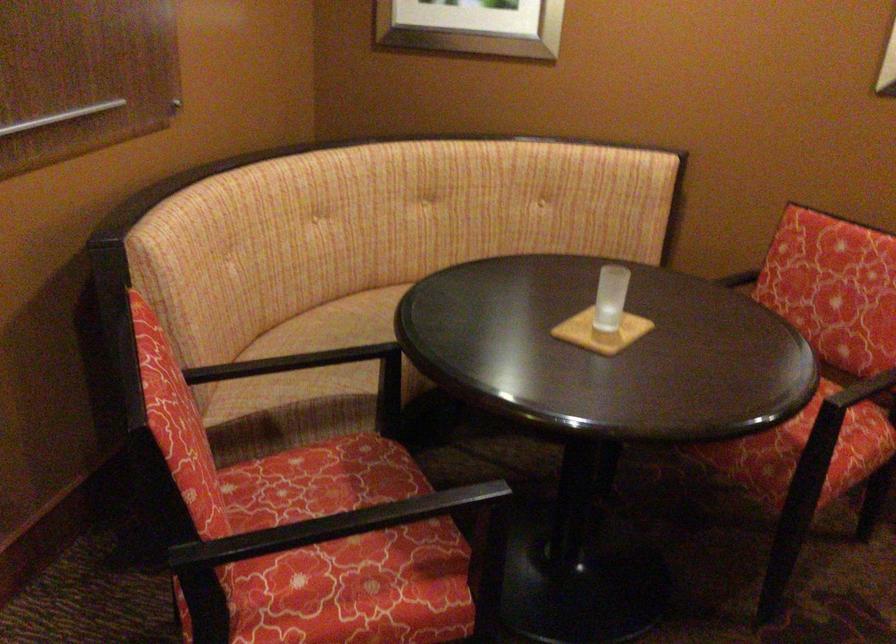
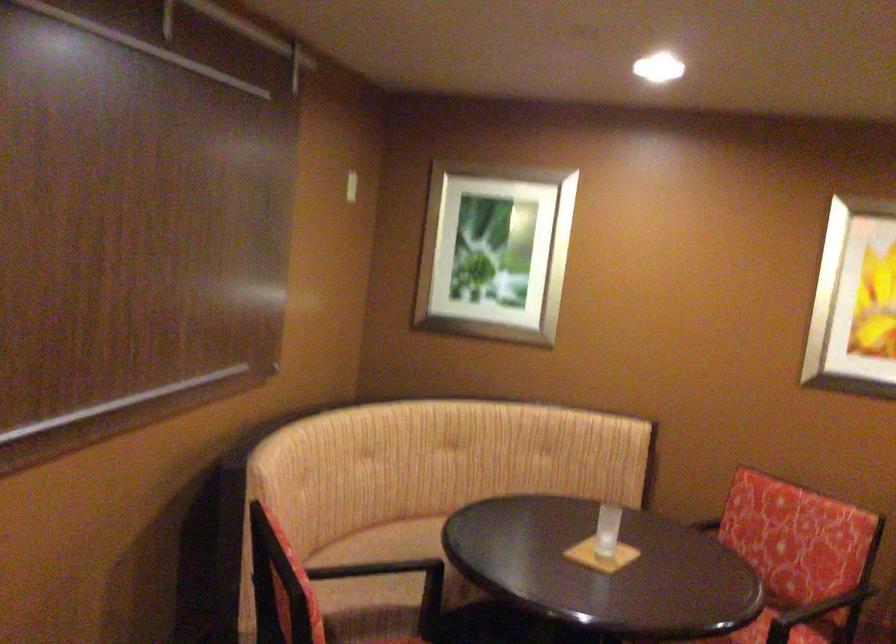
Question: The first image is from the beginning of the video and the second image is from the end. How did the camera likely rotate when shooting the video?

Choices:
 (A) Left
 (B) Right
 (C) Up
 (D) Down

Answer: (C)